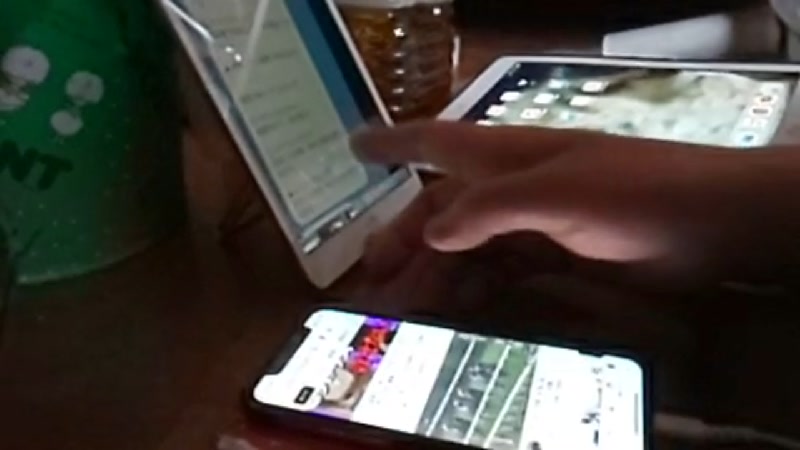
This screenshot has width=800, height=450. I want to click on jar, so click(x=392, y=64).